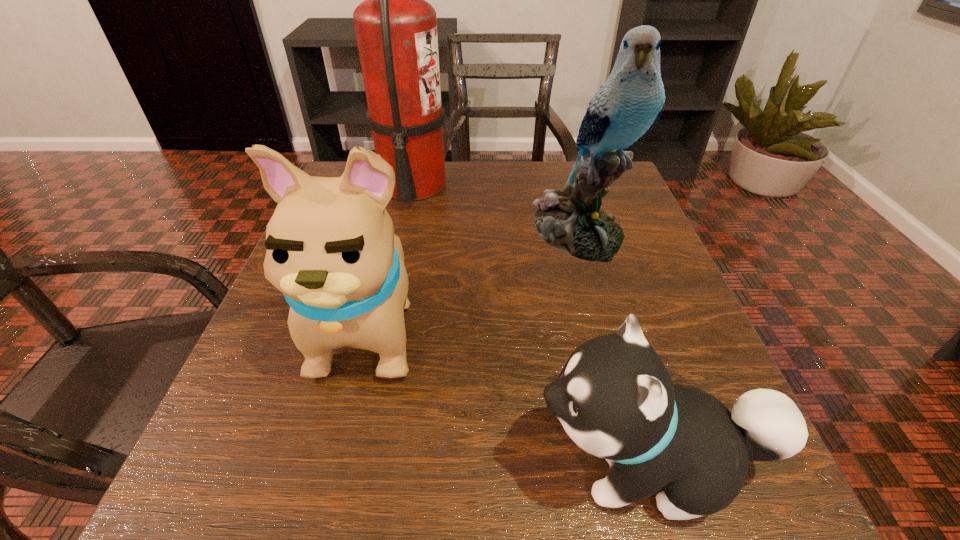
You are a GUI agent. You are given a task and a screenshot of the screen. Output one action in this format:
    pyautogui.click(x=<x>, y=<y>)
    Task: Click on the tallest object
    Image resolution: width=960 pixels, height=540 pixels.
    Given the screenshot: What is the action you would take?
    pyautogui.click(x=396, y=29)

The image size is (960, 540). Find the location of `the second tallest object`. the second tallest object is located at coordinates [627, 106].

This screenshot has height=540, width=960. Find the location of `the second shortest object`. the second shortest object is located at coordinates tap(331, 249).

Where is `the third farthest object`? the third farthest object is located at coordinates (331, 249).

You are a GUI agent. You are given a task and a screenshot of the screen. Output one action in this format:
    pyautogui.click(x=<x>, y=<y>)
    Task: Click on the shortest object
    
    Given the screenshot: What is the action you would take?
    pyautogui.click(x=614, y=397)

Where is `the right puppy`? the right puppy is located at coordinates (614, 397).

Find the location of `free spot located toward the nozzle of the tallest object`. free spot located toward the nozzle of the tallest object is located at coordinates tap(608, 186).

Where is `vacant space located on the face of the third shortest object`? This screenshot has width=960, height=540. vacant space located on the face of the third shortest object is located at coordinates (635, 436).

You are a GUI agent. You are given a task and a screenshot of the screen. Output one action in this format:
    pyautogui.click(x=<x>, y=<y>)
    Task: Click on the free space located on the face of the taller puppy
    The width and height of the screenshot is (960, 540).
    Given the screenshot: What is the action you would take?
    pyautogui.click(x=322, y=525)

The image size is (960, 540). Find the location of `vacant space located at the face of the nearest object`. vacant space located at the face of the nearest object is located at coordinates (492, 464).